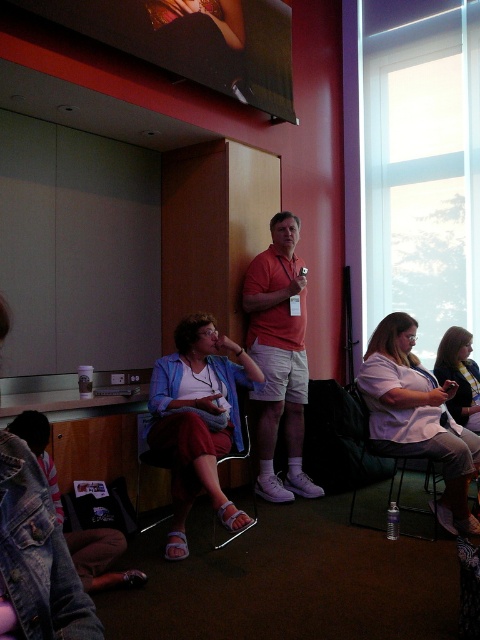
Question: Is matte blue shirt at center wider than matte pink shirt at center?

Choices:
 (A) no
 (B) yes

Answer: (B)

Question: Which of the following is the farthest from the observer?

Choices:
 (A) matte pink shirt at center
 (B) matte orange shirt at center
 (C) light purple shirt at center

Answer: (B)

Question: Among these objects, which one is nearest to the camera?

Choices:
 (A) matte orange shirt at center
 (B) matte pink shirt at center
 (C) light purple shirt at center

Answer: (C)

Question: Based on their relative distances, which object is nearer to the matte orange shirt at center?

Choices:
 (A) matte blue shirt at center
 (B) matte pink shirt at center
 (C) light purple shirt at center

Answer: (A)

Question: Does matte blue shirt at center have a greater width compared to light purple shirt at center?

Choices:
 (A) no
 (B) yes

Answer: (A)

Question: In this image, where is matte blue shirt at center located relative to matte orange shirt at center?

Choices:
 (A) below
 (B) above

Answer: (A)